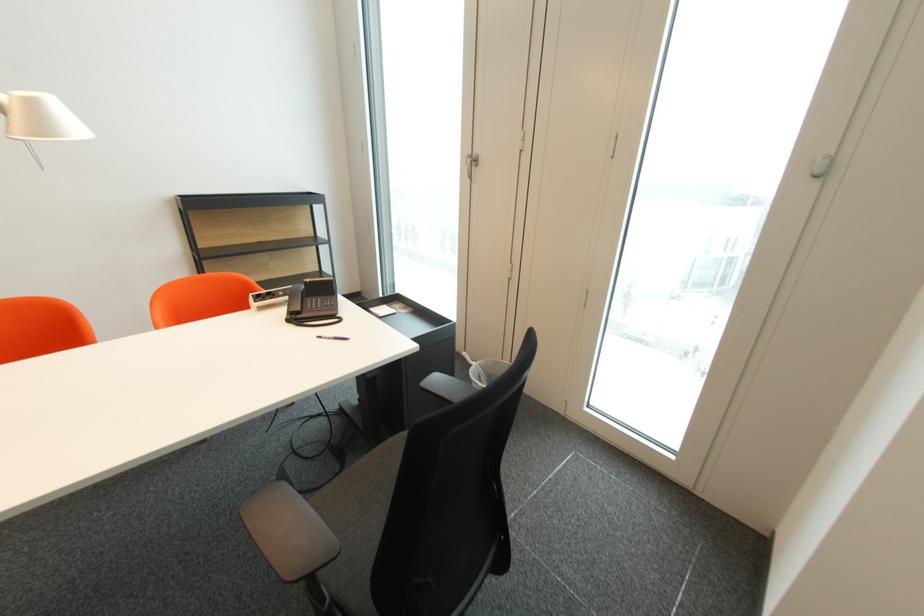
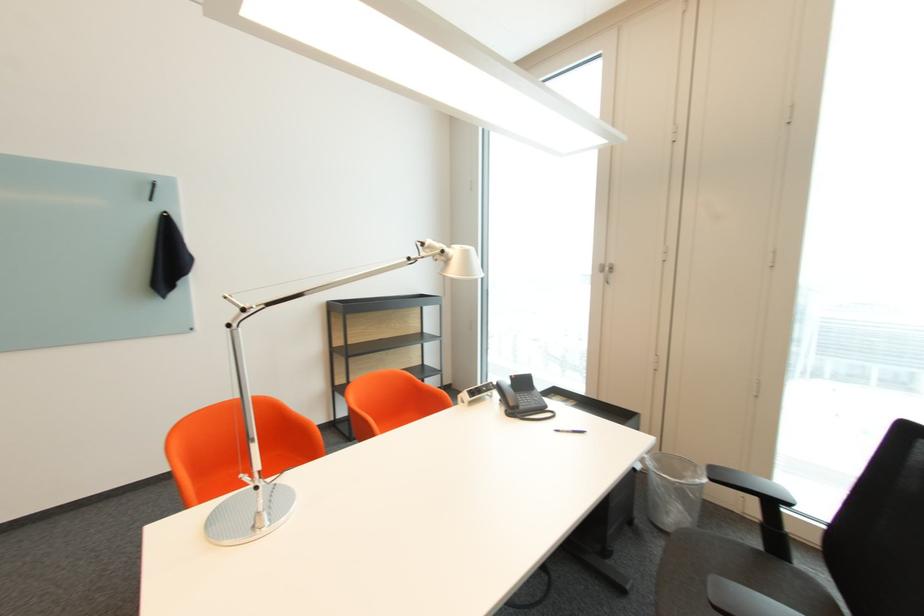
The point at (336, 339) is marked in the first image. Where is the corresponding point in the second image?

(574, 432)